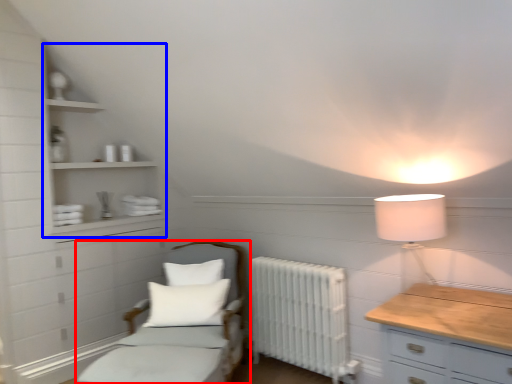
Question: Which object is further to the camera taking this photo, furniture (highlighted by a red box) or cabinet (highlighted by a blue box)?

Choices:
 (A) furniture
 (B) cabinet

Answer: (B)